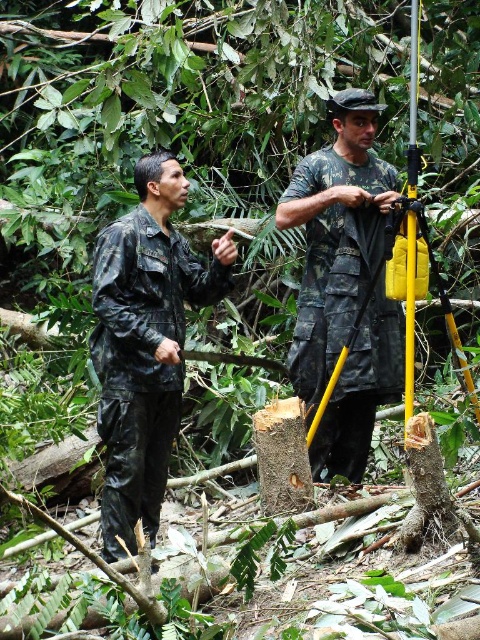
Measure the distance between point (91, 358) and camera.

A distance of 11.42 meters exists between point (91, 358) and camera.

The image size is (480, 640). What are the coordinates of `matte black uniform at center` in the screenshot? It's located at (144, 344).